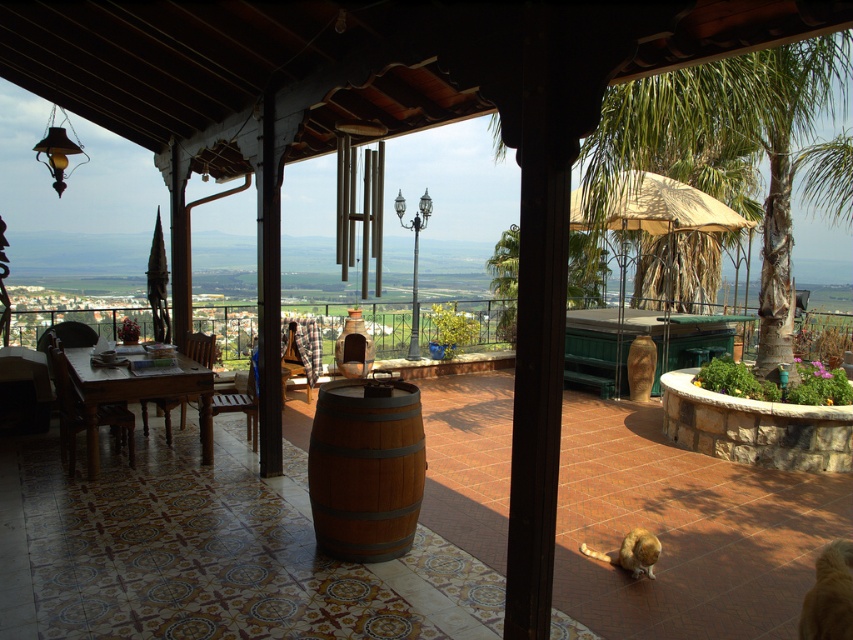
You are standing on the patio and want to walk from the wooden table at left to the green leafy palm tree at upper right. Which direction should you face to move towards it?

You should face towards the upper right direction to move towards the green leafy palm tree at upper right since it is located in that direction relative to the wooden table at left.

You are sitting at the wooden table at left and want to reach the brown wooden barrel at center. In which direction should you move to get there?

You should move to the right because the brown wooden barrel at center is to the right of the wooden table at left.

You are standing at the center of the patio and want to take a photo of the green leafy palm tree at upper right. Based on its coordinates, in which direction should you move to frame it properly?

The green leafy palm tree at upper right is located at coordinates point (724, 141). Since the x coordinate is 0.223, which is closer to the left side of the image, you should move to the left to frame it properly.